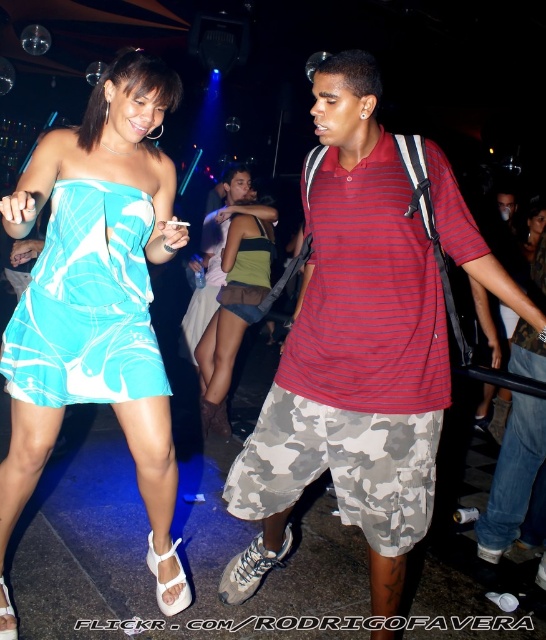
Question: Which of the following is the farthest from the observer?

Choices:
 (A) turquoise satin dress at center
 (B) striped cotton polo shirt at center
 (C) green textured tank top at center
 (D) turquoise silk dress at center

Answer: (C)

Question: Does striped cotton polo shirt at center appear over green textured tank top at center?

Choices:
 (A) no
 (B) yes

Answer: (A)

Question: Which of these objects is positioned closest to the turquoise silk dress at center?

Choices:
 (A) turquoise satin dress at center
 (B) green jersey at center
 (C) green textured tank top at center

Answer: (A)

Question: Does green jersey at center have a lesser width compared to white printed fabric dress at center?

Choices:
 (A) no
 (B) yes

Answer: (B)

Question: Does turquoise satin dress at center appear under green textured tank top at center?

Choices:
 (A) yes
 (B) no

Answer: (A)

Question: Considering the real-world distances, which object is farthest from the striped cotton polo shirt at center?

Choices:
 (A) turquoise satin dress at center
 (B) white printed fabric dress at center
 (C) turquoise silk dress at center
 (D) green textured tank top at center

Answer: (B)